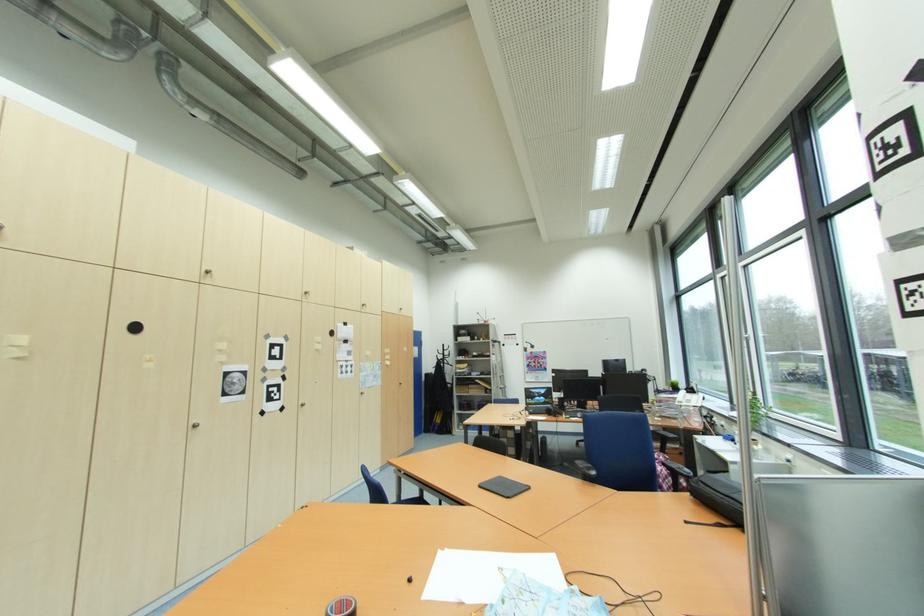
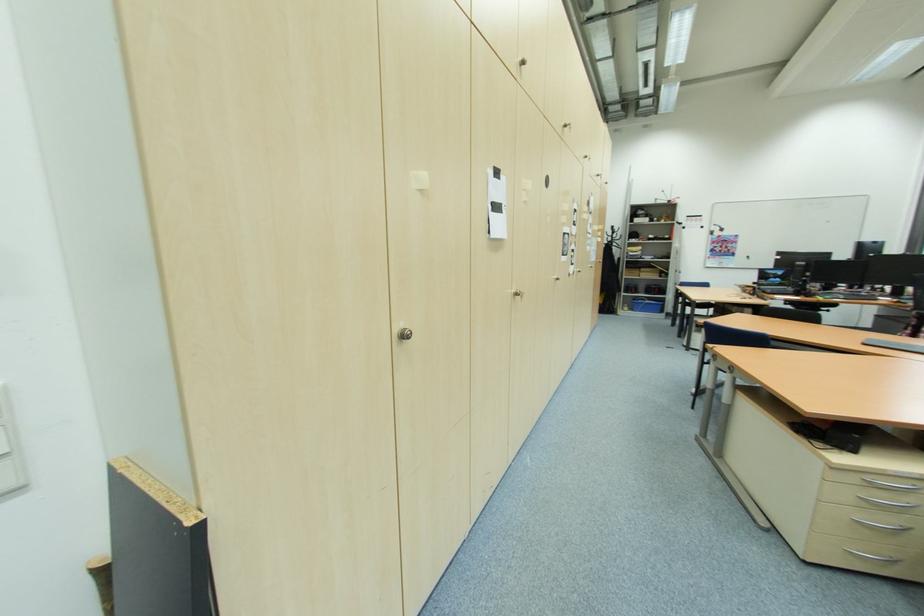
Question: The images are taken continuously from a first-person perspective. In which direction are you moving?

Choices:
 (A) Left
 (B) Right
 (C) Forward
 (D) Backward

Answer: (A)